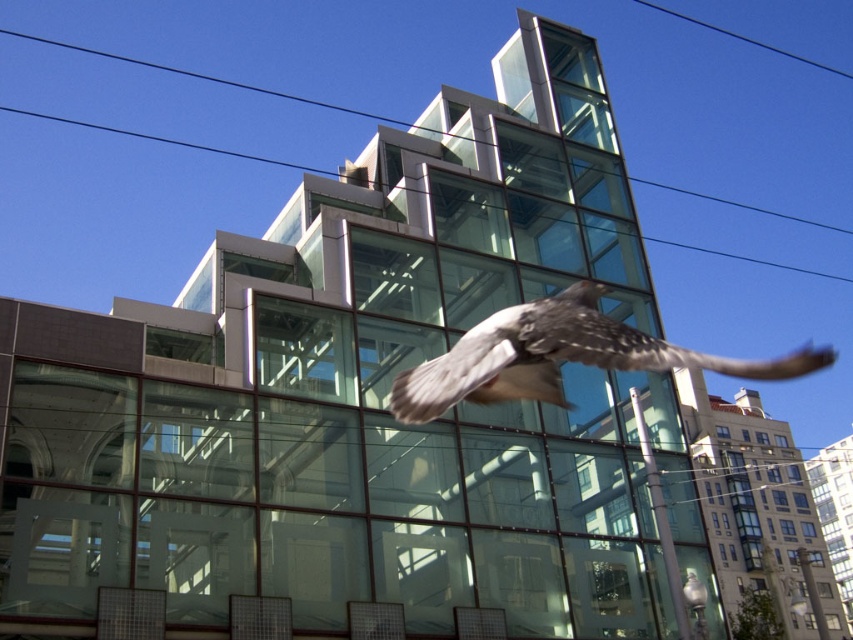
Question: Which point appears closest to the camera in this image?

Choices:
 (A) (633, 330)
 (B) (793, 220)

Answer: (A)

Question: Which object appears closest to the camera in this image?

Choices:
 (A) speckled feathered bird at center
 (B) transparent glass power line at upper center

Answer: (A)

Question: Considering the relative positions of speckled feathered bird at center and transparent glass power line at upper center in the image provided, where is speckled feathered bird at center located with respect to transparent glass power line at upper center?

Choices:
 (A) above
 (B) below

Answer: (B)

Question: Is speckled feathered bird at center further to camera compared to transparent glass power line at upper center?

Choices:
 (A) yes
 (B) no

Answer: (B)

Question: Can you confirm if speckled feathered bird at center is smaller than transparent glass power line at upper center?

Choices:
 (A) no
 (B) yes

Answer: (B)